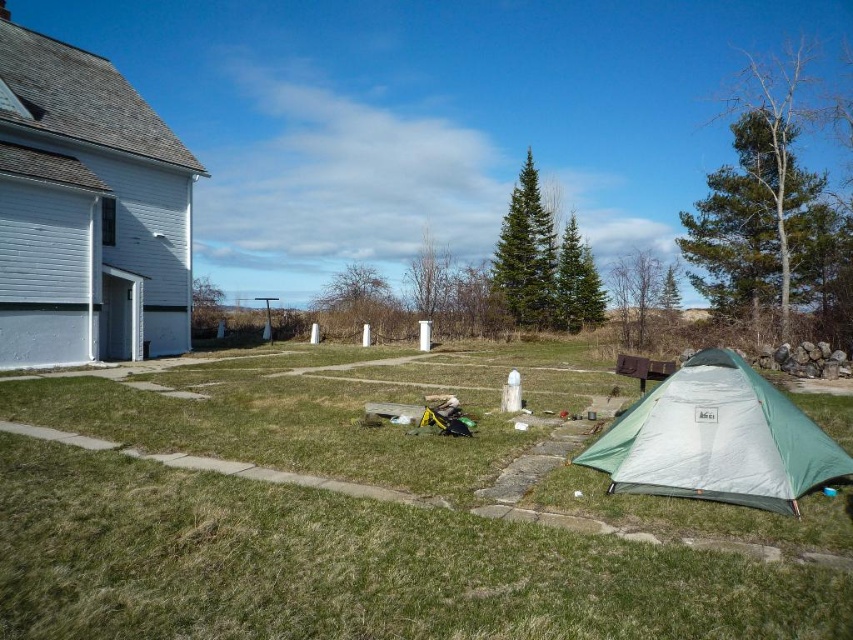
Looking at this image, you are standing in the scene and want to move from the green grass at lower left to the green fabric tent at lower right. Which direction should you walk to get closer to the tent?

Since the green grass at lower left is closer to the viewer than the green fabric tent at lower right, you should walk towards the right to move closer to the tent.

You are planning to set up a picnic blanket between the green grass at lower left and the white painted wood house at left. The picnic blanket is 10 meters long. Will it reach both objects without bending?

The distance between the green grass at lower left and the white painted wood house at left is 10.74 meters. Since the picnic blanket is only 10 meters long, it will not be long enough to reach both objects without bending.